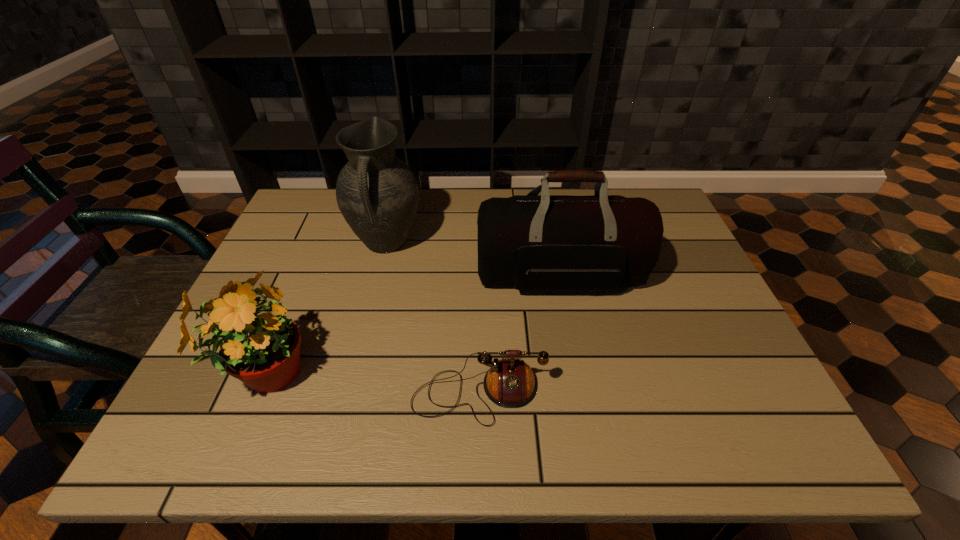
At what (x,y) coordinates should I click in order to perform the action: click on object that is at the left edge. Please return your answer as a coordinate pair (x, y). This screenshot has width=960, height=540. Looking at the image, I should click on (261, 348).

You are a GUI agent. You are given a task and a screenshot of the screen. Output one action in this format:
    pyautogui.click(x=<x>, y=<y>)
    Task: Click on the object that is at the right edge
    
    Given the screenshot: What is the action you would take?
    pyautogui.click(x=545, y=242)

The height and width of the screenshot is (540, 960). I want to click on object that is at the near left corner, so click(x=261, y=348).

At what (x,y) coordinates should I click in order to perform the action: click on vacant space at the far edge of the desktop. Please return your answer as a coordinate pair (x, y). Looking at the image, I should click on (469, 231).

This screenshot has height=540, width=960. In the image, there is a desktop. In order to click on vacant space at the near edge in this screenshot , I will do `click(540, 415)`.

Where is `free space at the left edge`? The image size is (960, 540). free space at the left edge is located at coordinates (316, 271).

The image size is (960, 540). In order to click on vacant space at the right edge of the desktop in this screenshot , I will do `click(696, 341)`.

At what (x,y) coordinates should I click in order to perform the action: click on free space at the far left corner. Please return your answer as a coordinate pair (x, y). The height and width of the screenshot is (540, 960). Looking at the image, I should click on (308, 205).

The height and width of the screenshot is (540, 960). I want to click on vacant space at the near left corner of the desktop, so click(228, 426).

Identify the location of free spot between the flowerpot and the pitcher. Image resolution: width=960 pixels, height=540 pixels. (324, 309).